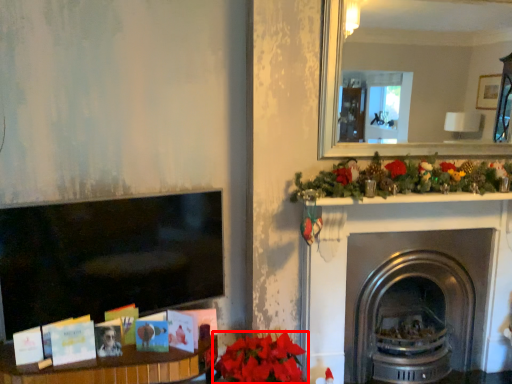
Question: From the image's perspective, what is the correct spatial relationship of flower (annotated by the red box) in relation to fireplace?

Choices:
 (A) below
 (B) above

Answer: (A)